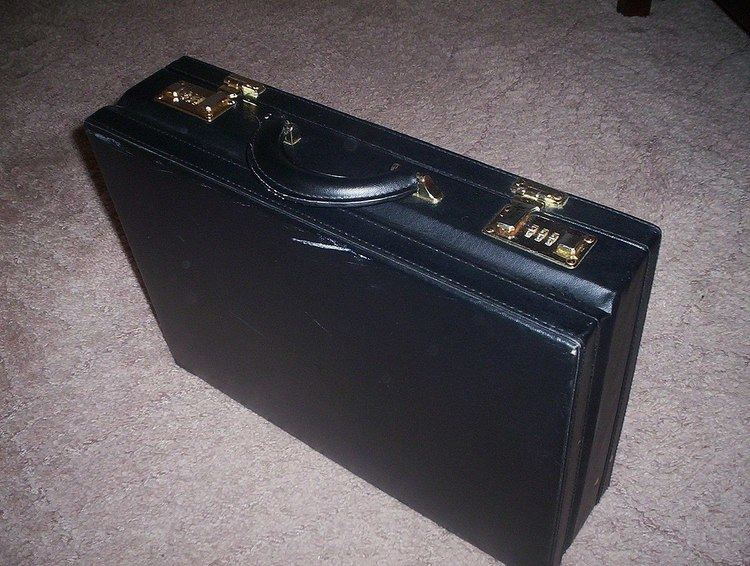
The height and width of the screenshot is (566, 750). I want to click on leather is dented in this area, so pyautogui.click(x=603, y=308).